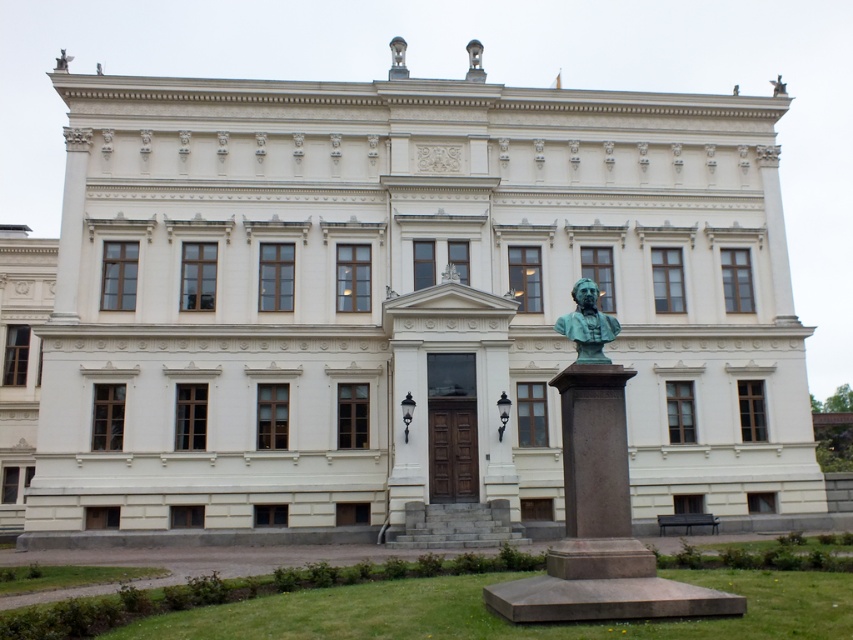
How distant is bronze bust at center from bronze statue at upper center?

bronze bust at center is 162.67 feet away from bronze statue at upper center.

Is bronze bust at center smaller than bronze statue at upper center?

Correct, bronze bust at center occupies less space than bronze statue at upper center.

Describe the element at coordinates (587, 323) in the screenshot. I see `bronze bust at center` at that location.

At what (x,y) coordinates should I click in order to perform the action: click on bronze bust at center. Please return your answer as a coordinate pair (x, y). The image size is (853, 640). Looking at the image, I should click on (587, 323).